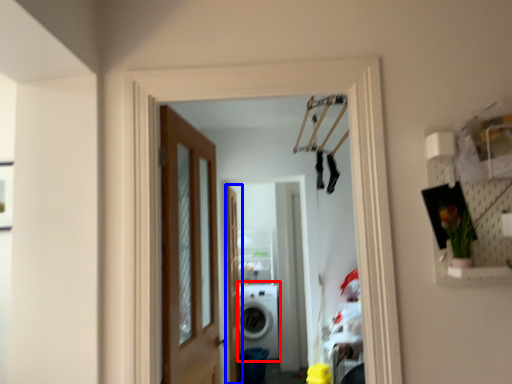
Question: Which point is further to the camera, washing machine (highlighted by a red box) or screen door (highlighted by a blue box)?

Choices:
 (A) washing machine
 (B) screen door

Answer: (A)